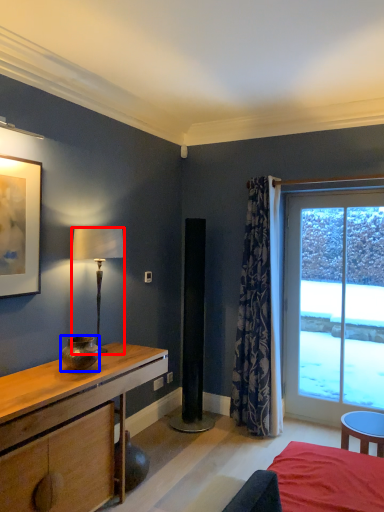
Question: Which object appears closest to the camera in this image, lamp (highlighted by a red box) or vase (highlighted by a blue box)?

Choices:
 (A) lamp
 (B) vase

Answer: (B)